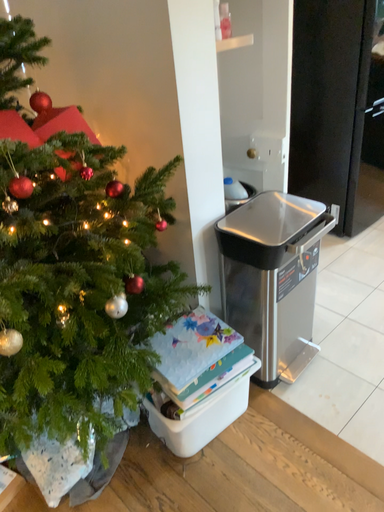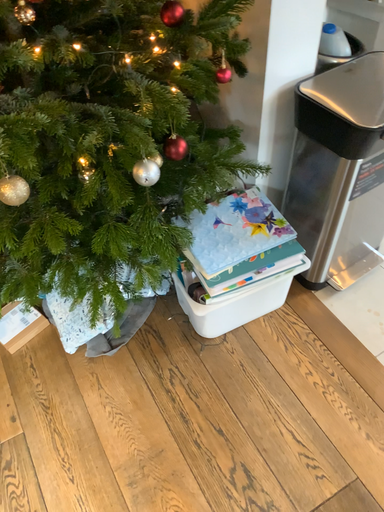
Question: Which way did the camera rotate in the video?

Choices:
 (A) rotated right
 (B) rotated left

Answer: (B)